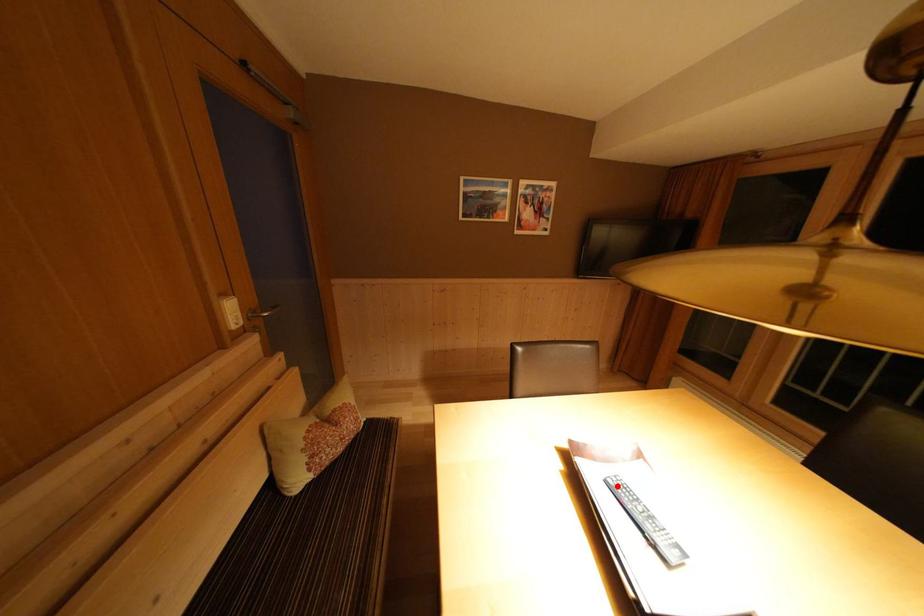
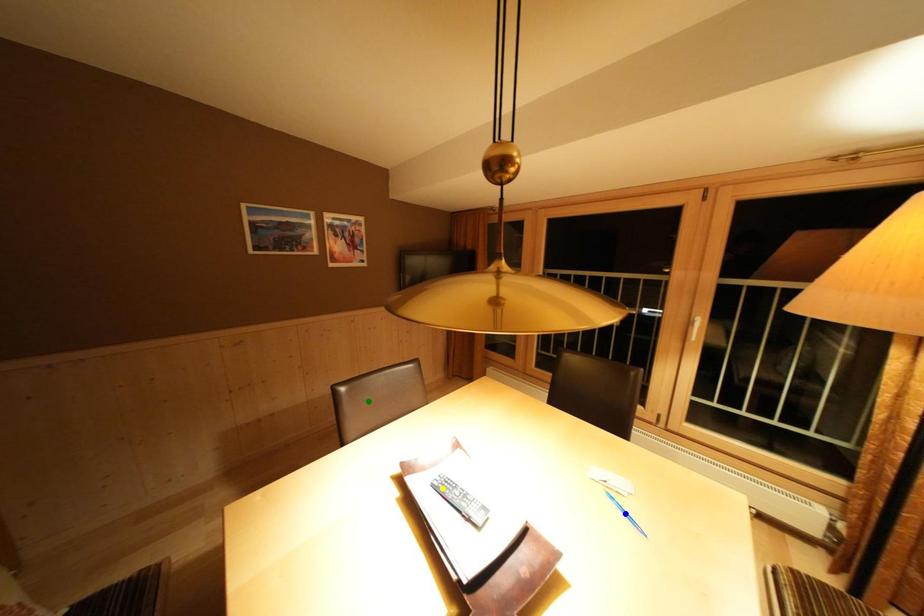
Question: I am providing you with two images of the same scene from different viewpoints. A red point is marked on the first image. You are given multiple points on the second image. In image 2, which mark is for the same physical point as the one in image 1?

Choices:
 (A) yellow point
 (B) green point
 (C) blue point

Answer: (A)